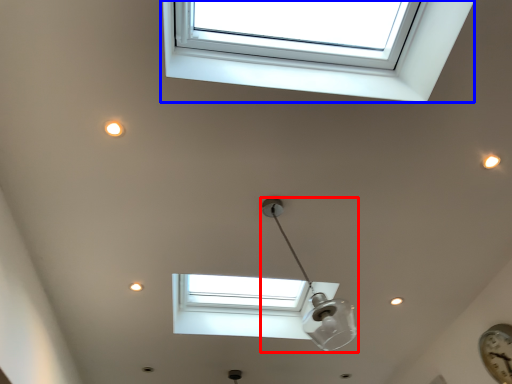
Question: Which point is further to the camera, lamp (highlighted by a red box) or window (highlighted by a blue box)?

Choices:
 (A) lamp
 (B) window

Answer: (A)